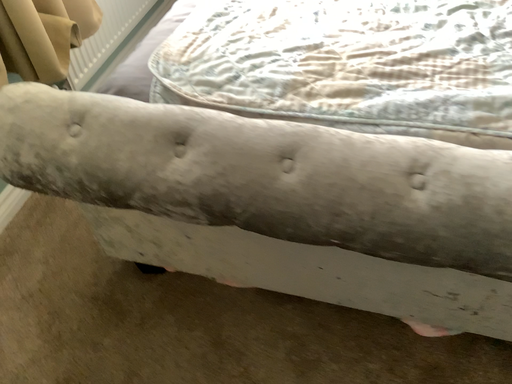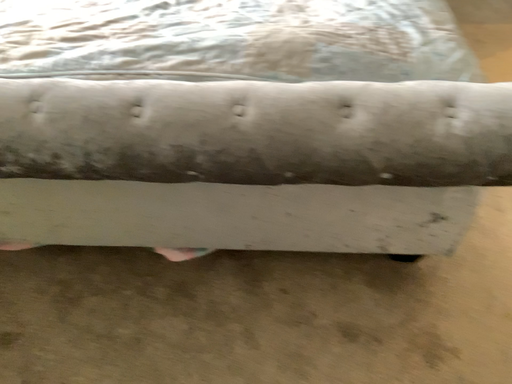
Question: Which way did the camera rotate in the video?

Choices:
 (A) rotated left
 (B) rotated right

Answer: (B)